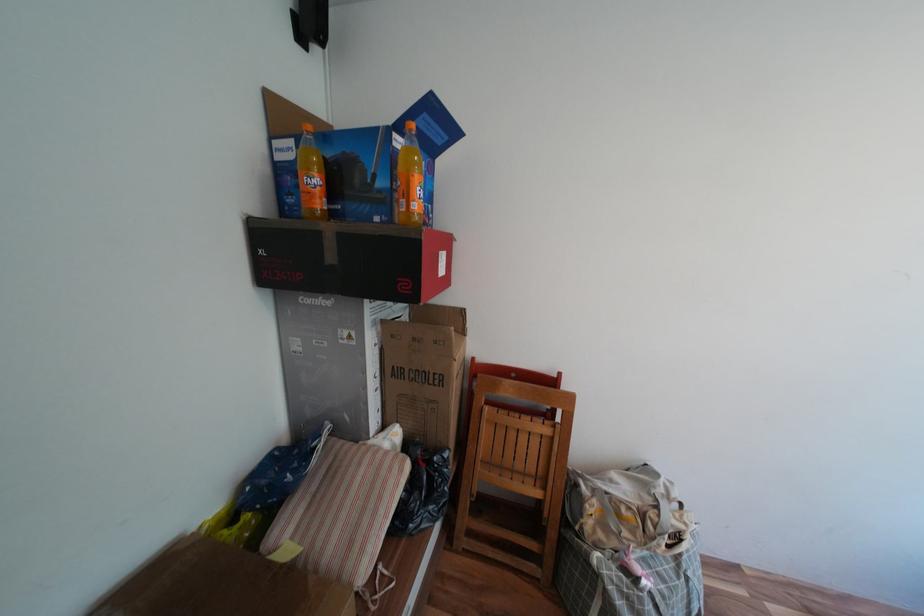
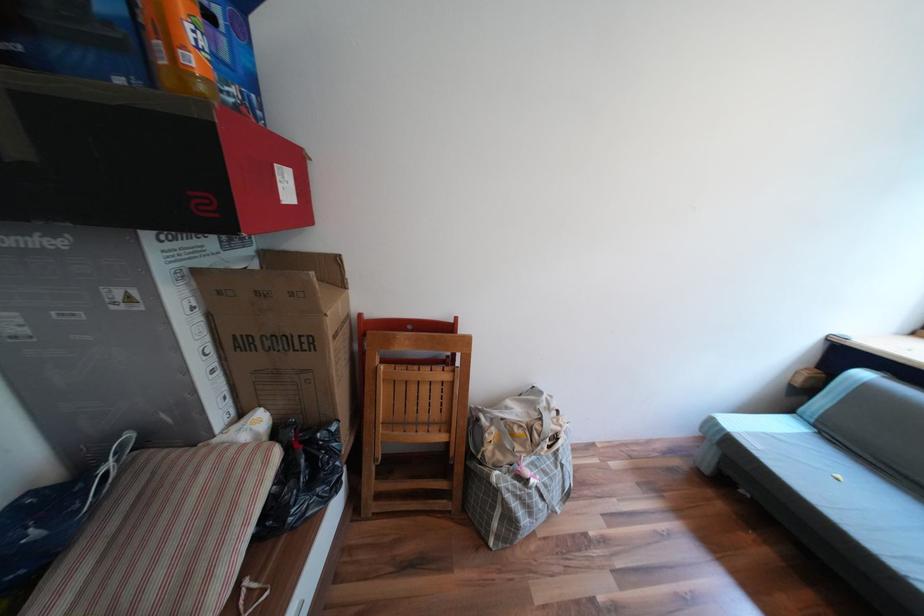
Where in the second image is the point corresponding to [386,374] from the first image?

(219, 349)